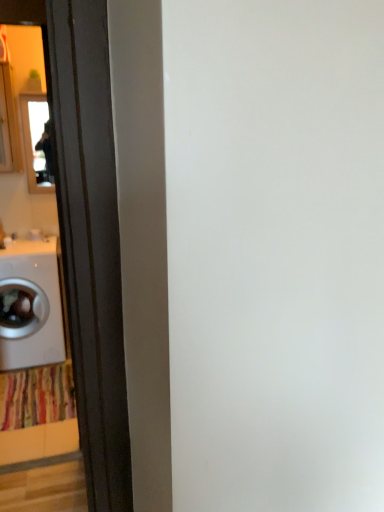
Image resolution: width=384 pixels, height=512 pixels. What do you see at coordinates (31, 306) in the screenshot?
I see `white glossy washing machine at left` at bounding box center [31, 306].

The height and width of the screenshot is (512, 384). Find the location of `white glossy washing machine at left`. white glossy washing machine at left is located at coordinates point(31,306).

The image size is (384, 512). Find the location of `white glossy washing machine at left`. white glossy washing machine at left is located at coordinates (31, 306).